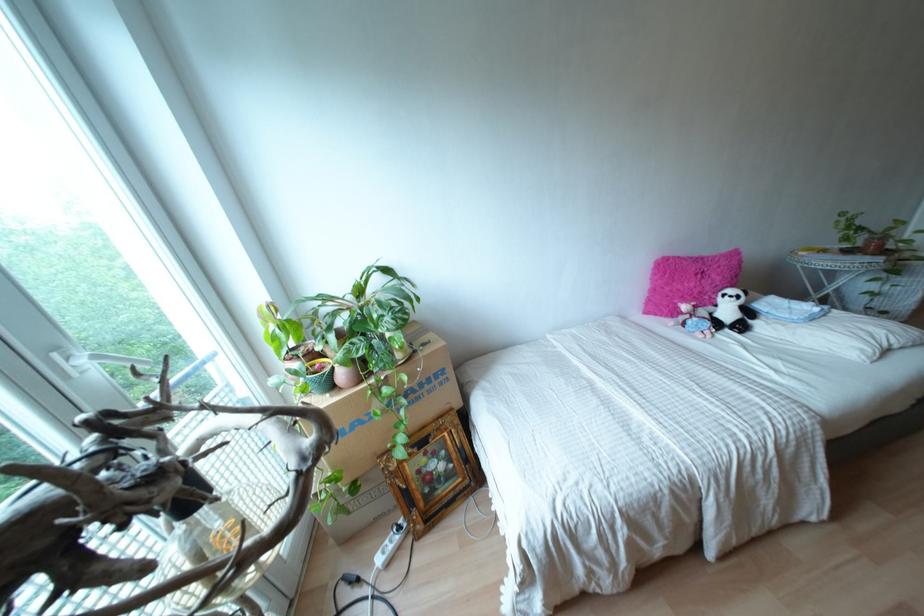
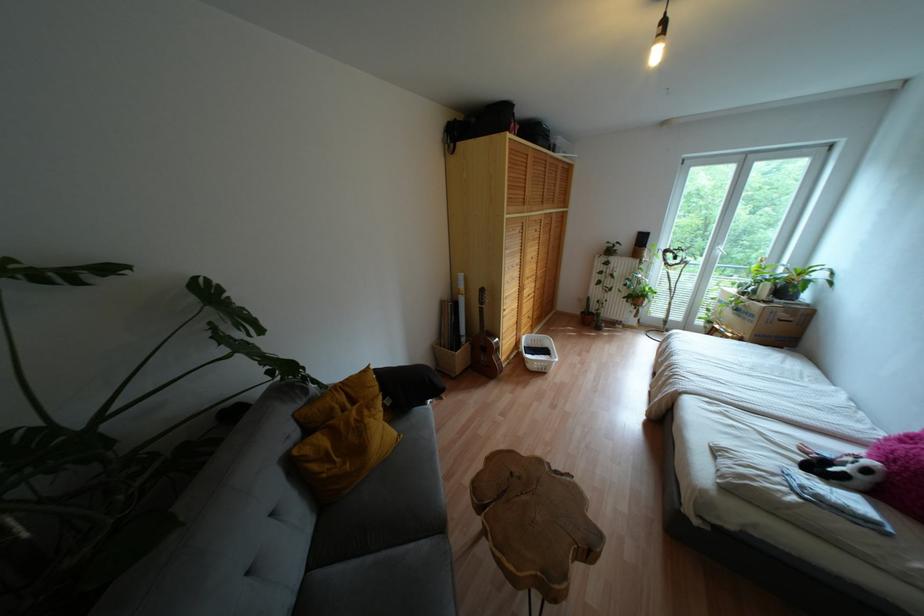
The point at (418, 398) is marked in the first image. Where is the corresponding point in the second image?

(737, 315)